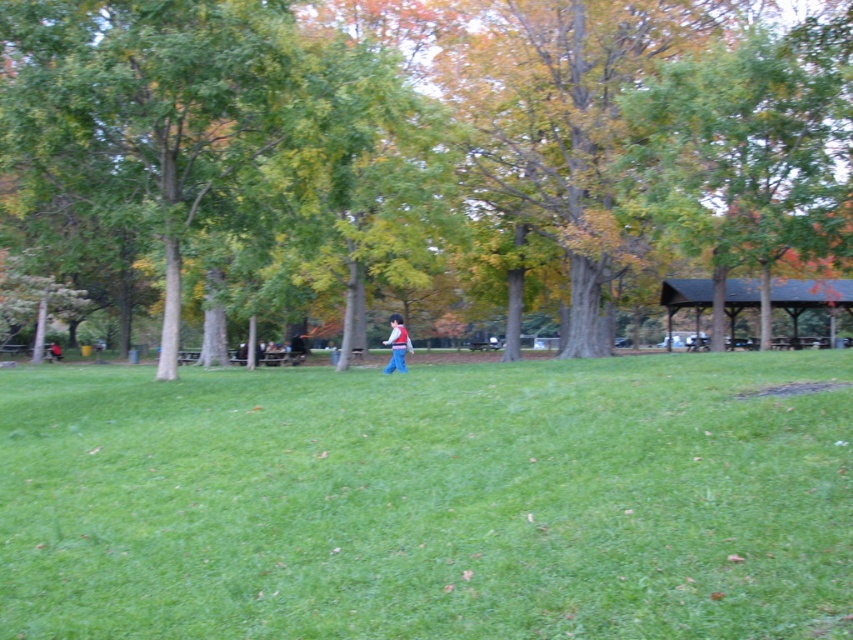
Which is in front, point (352, 147) or point (798, 152)?

Positioned in front is point (352, 147).

Between green leafy tree at center and green leafy tree at right, which one has more height?

green leafy tree at center

Between point (555, 157) and point (787, 42), which one is positioned behind?

The point (555, 157) is behind.

Where is `green leafy tree at center`? The width and height of the screenshot is (853, 640). green leafy tree at center is located at coordinates (433, 136).

Is green leafy tree at center taller than matte red vest at center?

Yes, green leafy tree at center is taller than matte red vest at center.

Is green leafy tree at center positioned in front of matte red vest at center?

Yes, green leafy tree at center is in front of matte red vest at center.

Locate an element on the screen. green leafy tree at center is located at coordinates (433, 136).

Which is below, green grassy field at center or green leafy tree at center?

green grassy field at center

Between green grassy field at center and green leafy tree at center, which one appears on the right side from the viewer's perspective?

green grassy field at center is more to the right.

The image size is (853, 640). I want to click on green grassy field at center, so pos(430,500).

Locate an element on the screen. green grassy field at center is located at coordinates (430, 500).